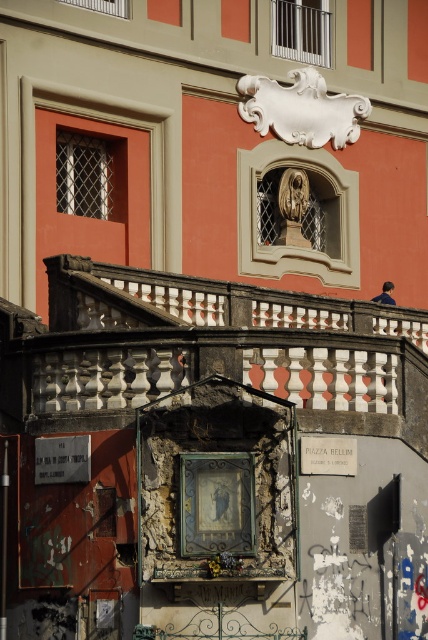
Which is below, metallic gold clock at center or white stone plaque at lower left?

metallic gold clock at center is below.

Is metallic gold clock at center positioned in front of white stone plaque at lower left?

Yes, metallic gold clock at center is closer to the viewer.

Measure the distance between metallic gold clock at center and camera.

metallic gold clock at center is 151.55 feet from camera.

Find the location of a particular element. Image resolution: width=428 pixels, height=640 pixels. metallic gold clock at center is located at coordinates (216, 502).

Between metallic gold clock at center and white matte plaque at center, which one appears on the left side from the viewer's perspective?

Positioned to the left is metallic gold clock at center.

Which is above, metallic gold clock at center or white matte plaque at center?

white matte plaque at center is above.

Does point (187, 536) come farther from viewer compared to point (338, 440)?

No, it is not.

This screenshot has width=428, height=640. Identify the location of metallic gold clock at center. (216, 502).

Who is positioned more to the right, white stone plaque at lower left or white matte plaque at center?

From the viewer's perspective, white matte plaque at center appears more on the right side.

Can you confirm if white stone plaque at lower left is positioned below white matte plaque at center?

Correct, white stone plaque at lower left is located below white matte plaque at center.

In the scene shown: Measure the distance between point (35, 483) and camera.

Point (35, 483) and camera are 161.98 feet apart from each other.

Locate an element on the screen. This screenshot has width=428, height=640. white stone plaque at lower left is located at coordinates (62, 460).